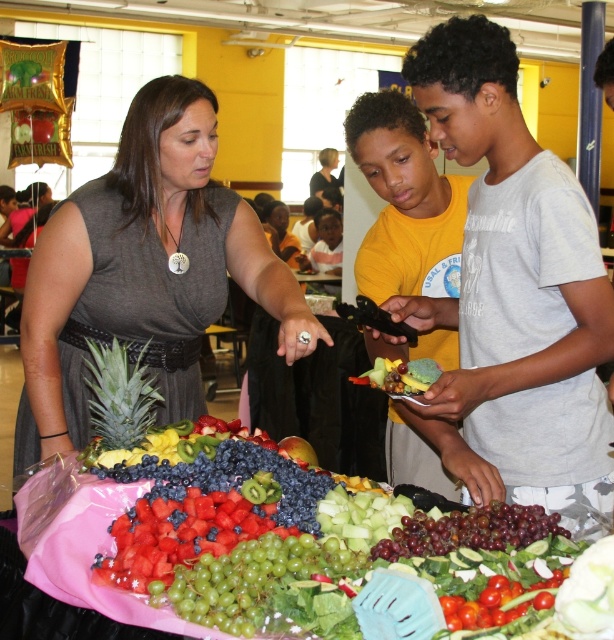
You are at a community event and need to move from point A to point B. Point A is at coordinate [155,83] and point B is at coordinate [340,605]. According to the image, which point is closer to the front of the scene?

Point B at coordinate [340,605] is closer to the front of the scene because point A at coordinate [155,83] is behind it.